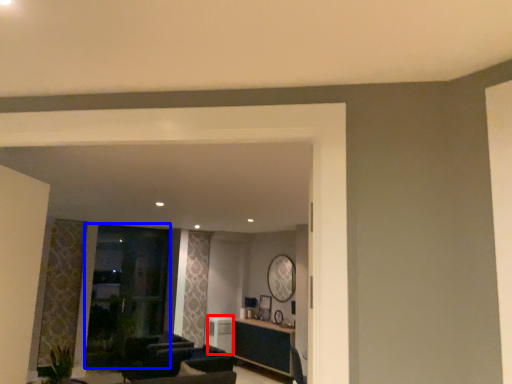
Question: Among these objects, which one is farthest to the camera, appliance (highlighted by a red box) or glass door (highlighted by a blue box)?

Choices:
 (A) appliance
 (B) glass door

Answer: (A)